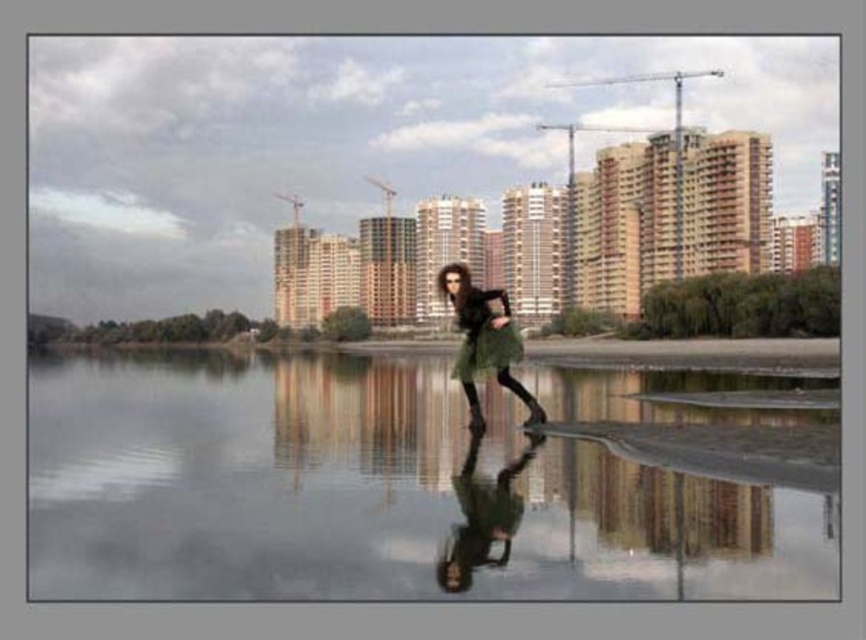
Question: Where is green matte skirt at center located in relation to green fuzzy coat at center in the image?

Choices:
 (A) right
 (B) left

Answer: (B)

Question: Can you confirm if green reflective water at center is positioned above green matte skirt at center?

Choices:
 (A) yes
 (B) no

Answer: (B)

Question: Considering the relative positions of green reflective water at center and green matte skirt at center in the image provided, where is green reflective water at center located with respect to green matte skirt at center?

Choices:
 (A) above
 (B) below

Answer: (B)

Question: Which point is farther to the camera?

Choices:
 (A) (470, 369)
 (B) (97, 449)
 (C) (498, 289)

Answer: (C)

Question: Which object is positioned farthest from the green fuzzy coat at center?

Choices:
 (A) green reflective water at center
 (B) green matte skirt at center
 (C) green fabric dress at center

Answer: (A)

Question: Which of the following is the closest to the observer?

Choices:
 (A) green matte skirt at center
 (B) green fabric dress at center
 (C) green fuzzy coat at center

Answer: (B)